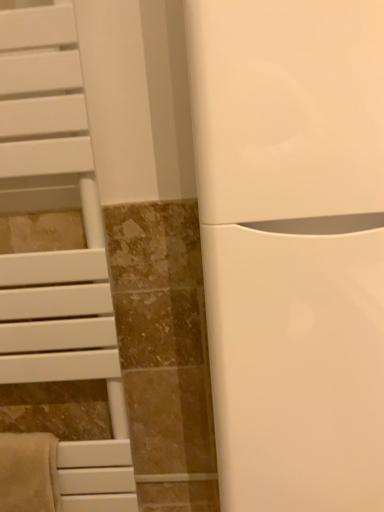
Question: Does white glossy toilet at center have a greater height compared to white matte towel rack at left?

Choices:
 (A) no
 (B) yes

Answer: (A)

Question: From the image's perspective, is white glossy toilet at center on white matte towel rack at left?

Choices:
 (A) yes
 (B) no

Answer: (A)

Question: Can you confirm if white glossy toilet at center is positioned to the left of white matte towel rack at left?

Choices:
 (A) no
 (B) yes

Answer: (A)

Question: Is white matte towel rack at left at the back of white glossy toilet at center?

Choices:
 (A) no
 (B) yes

Answer: (A)

Question: Does white glossy toilet at center have a smaller size compared to white matte towel rack at left?

Choices:
 (A) yes
 (B) no

Answer: (B)

Question: Considering the positions of white glossy toilet at center and beige soft towel at lower left in the image, is white glossy toilet at center wider or thinner than beige soft towel at lower left?

Choices:
 (A) wide
 (B) thin

Answer: (A)

Question: Considering the positions of white glossy toilet at center and beige soft towel at lower left in the image, is white glossy toilet at center taller or shorter than beige soft towel at lower left?

Choices:
 (A) short
 (B) tall

Answer: (B)

Question: In the image, is white glossy toilet at center positioned in front of or behind beige soft towel at lower left?

Choices:
 (A) front
 (B) behind

Answer: (A)

Question: Looking at the image, does white glossy toilet at center seem bigger or smaller compared to beige soft towel at lower left?

Choices:
 (A) big
 (B) small

Answer: (A)

Question: Considering their positions, is white matte towel rack at left located in front of or behind white glossy toilet at center?

Choices:
 (A) front
 (B) behind

Answer: (B)

Question: Which is correct: white matte towel rack at left is inside white glossy toilet at center, or outside of it?

Choices:
 (A) inside
 (B) outside

Answer: (B)

Question: Based on their positions, is white matte towel rack at left located to the left or right of white glossy toilet at center?

Choices:
 (A) right
 (B) left

Answer: (B)

Question: In terms of size, does white matte towel rack at left appear bigger or smaller than white glossy toilet at center?

Choices:
 (A) big
 (B) small

Answer: (B)

Question: Considering the positions of beige soft towel at lower left and white matte towel rack at left in the image, is beige soft towel at lower left bigger or smaller than white matte towel rack at left?

Choices:
 (A) big
 (B) small

Answer: (B)

Question: Considering the positions of beige soft towel at lower left and white matte towel rack at left in the image, is beige soft towel at lower left wider or thinner than white matte towel rack at left?

Choices:
 (A) thin
 (B) wide

Answer: (A)